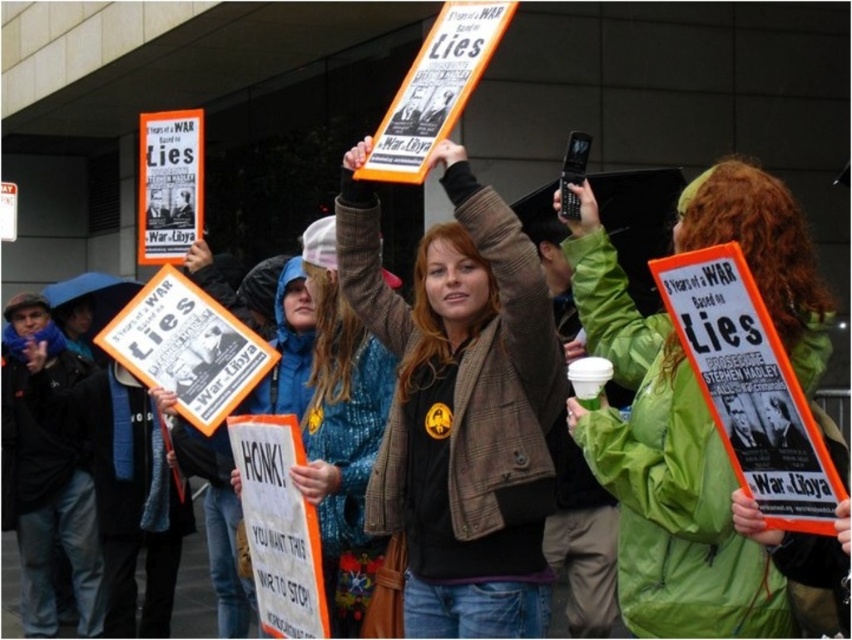
Question: Is matte orange sign at center smaller than green waterproof jacket at center?

Choices:
 (A) no
 (B) yes

Answer: (A)

Question: Which object appears closest to the camera in this image?

Choices:
 (A) green waterproof jacket at center
 (B) matte orange sign at center

Answer: (A)

Question: Does matte orange sign at center appear over green waterproof jacket at center?

Choices:
 (A) yes
 (B) no

Answer: (A)

Question: Which of the following is the closest to the observer?

Choices:
 (A) matte orange sign at center
 (B) green waterproof jacket at center

Answer: (B)

Question: Is matte orange sign at center behind green waterproof jacket at center?

Choices:
 (A) yes
 (B) no

Answer: (A)

Question: Among these objects, which one is farthest from the camera?

Choices:
 (A) green waterproof jacket at center
 (B) matte orange sign at center

Answer: (B)